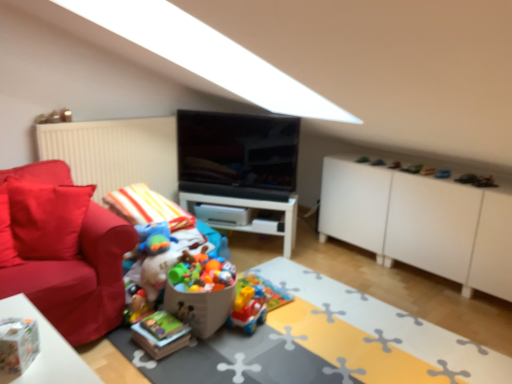
Question: Is point (289, 248) closer or farther from the camera than point (250, 296)?

Choices:
 (A) farther
 (B) closer

Answer: (A)

Question: Is white glossy table at center inside or outside of plastic colorful toy car at center, placed as the 1th toy when sorted from right to left?

Choices:
 (A) outside
 (B) inside

Answer: (A)

Question: Estimate the real-world distances between objects in this image. Which object is farther from the brightly colored plastic toys at center, the 2th toy positioned from the right?

Choices:
 (A) plastic toy train at center
 (B) matte red couch at left
 (C) white glossy table at center
 (D) plastic colorful toy car at center, positioned as the 2th toy in left-to-right order
 (E) white matte cabinet at right

Answer: (E)

Question: Estimate the real-world distances between objects in this image. Which object is farther from the matte red couch at left?

Choices:
 (A) plastic toy train at center
 (B) black glossy tv at center
 (C) white glossy table at center
 (D) white matte cabinet at right
 (E) brightly colored plastic toys at center, which is the 1th toy in left-to-right order

Answer: (D)